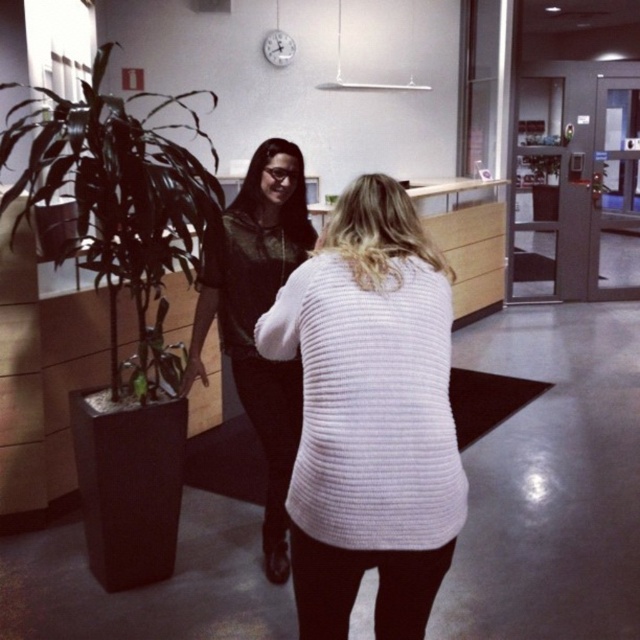
Question: Among these points, which one is nearest to the camera?

Choices:
 (A) (273, 451)
 (B) (330, 548)
 (C) (337, 195)

Answer: (B)

Question: Does green leafy plant at left appear on the left side of green leafy plant at center?

Choices:
 (A) no
 (B) yes

Answer: (B)

Question: Which is nearer to the white ribbed sweater at center?

Choices:
 (A) green leafy plant at left
 (B) matte black hoodie at center
 (C) green leafy plant at center
 (D) white textured sweater at center

Answer: (D)

Question: Can you confirm if white ribbed sweater at center is bigger than green leafy plant at center?

Choices:
 (A) yes
 (B) no

Answer: (A)

Question: Which object appears closest to the camera in this image?

Choices:
 (A) green leafy plant at center
 (B) matte black hoodie at center
 (C) white ribbed sweater at center

Answer: (C)

Question: Where is green leafy plant at left located in relation to green leafy plant at center in the image?

Choices:
 (A) left
 (B) right

Answer: (A)